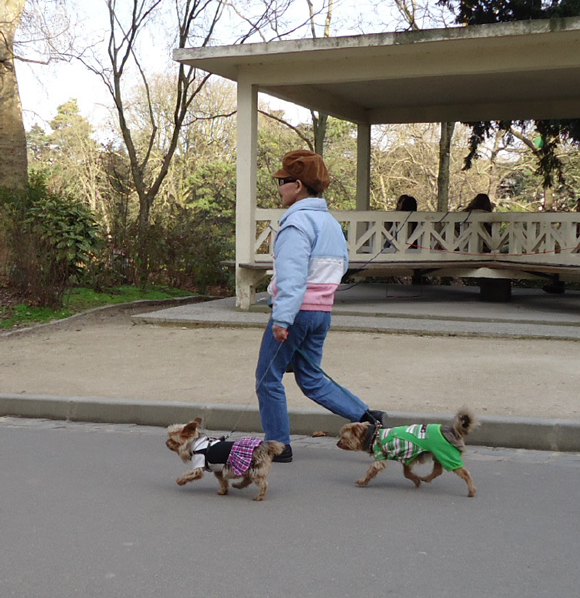
You are a GUI agent. You are given a task and a screenshot of the screen. Output one action in this format:
    pyautogui.click(x=<x>, y=<y>)
    Task: Click on the walking surfaces
    
    Given the screenshot: What is the action you would take?
    pyautogui.click(x=217, y=311), pyautogui.click(x=175, y=378), pyautogui.click(x=140, y=526), pyautogui.click(x=83, y=300)